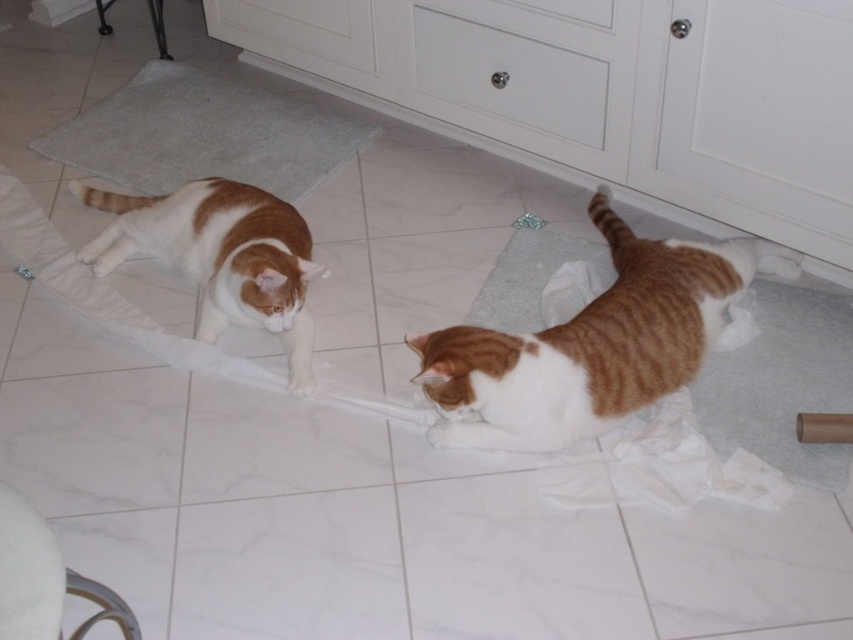
Can you confirm if white matte drawer at upper center is positioned above orange-white fur cat at left?

Yes.

Describe the element at coordinates (525, 72) in the screenshot. The image size is (853, 640). I see `white matte drawer at upper center` at that location.

The height and width of the screenshot is (640, 853). What are the coordinates of `white matte drawer at upper center` in the screenshot? It's located at (525, 72).

Between point (636, 90) and point (105, 145), which one is positioned behind?

Point (105, 145)

Does white glossy cabinet at upper center appear under gray soft mat at upper left?

Actually, white glossy cabinet at upper center is above gray soft mat at upper left.

Image resolution: width=853 pixels, height=640 pixels. I want to click on white glossy cabinet at upper center, so click(x=599, y=92).

From the picture: Does gray soft mat at upper left have a greater height compared to orange-white fur cat at left?

Indeed, gray soft mat at upper left has a greater height compared to orange-white fur cat at left.

Which of these two, gray soft mat at upper left or orange-white fur cat at left, stands shorter?

Standing shorter between the two is orange-white fur cat at left.

Where is `gray soft mat at upper left`? This screenshot has height=640, width=853. gray soft mat at upper left is located at coordinates (202, 134).